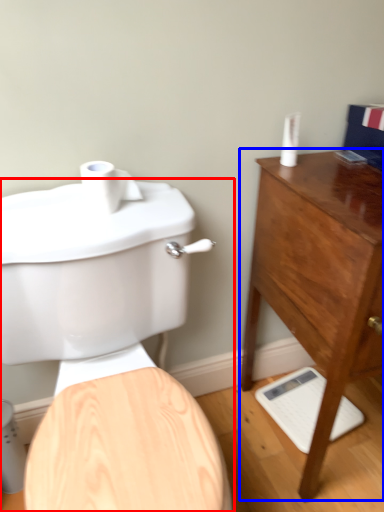
Question: Among these objects, which one is nearest to the camera, toilet (highlighted by a red box) or chest of drawers (highlighted by a blue box)?

Choices:
 (A) toilet
 (B) chest of drawers

Answer: (A)